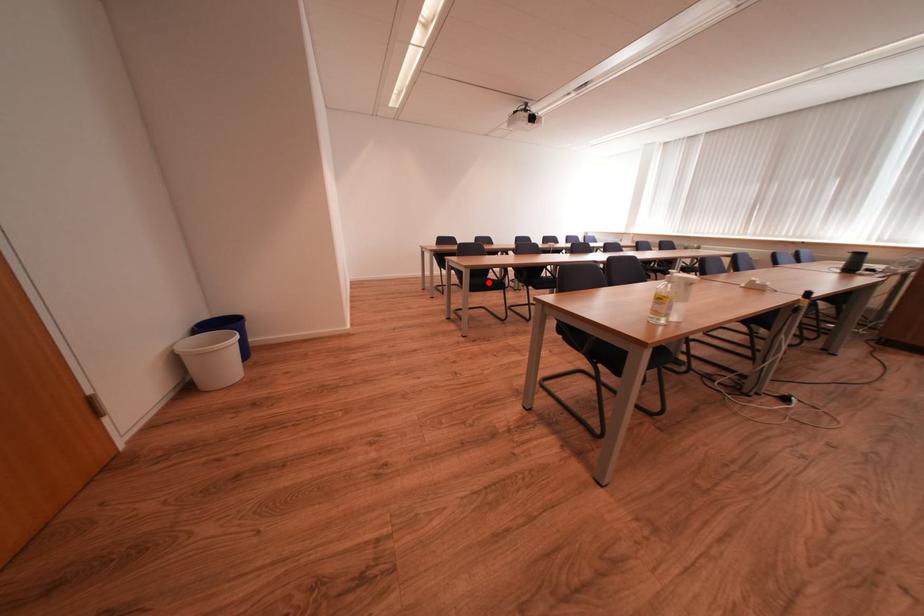
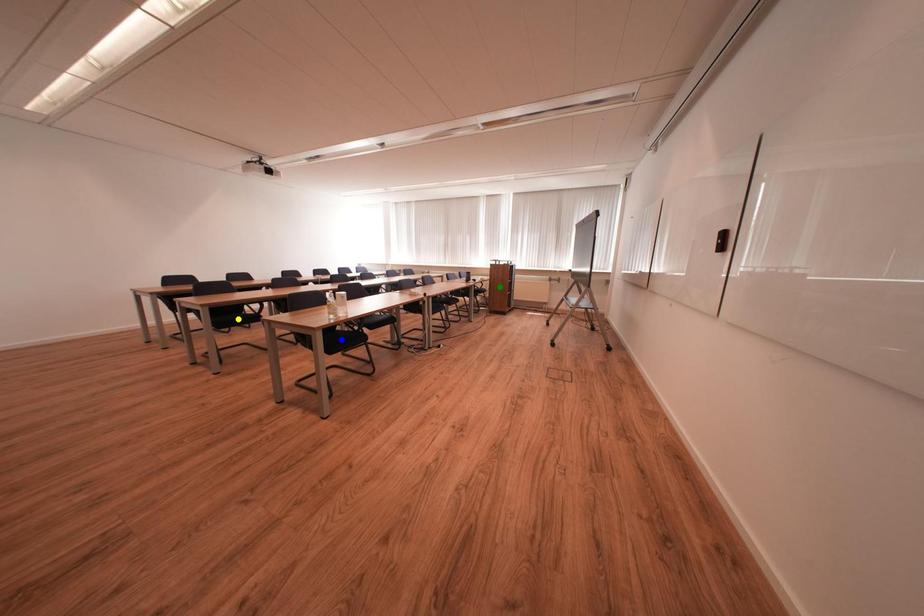
Question: I am providing you with two images of the same scene from different viewpoints. A red point is marked on the first image. You are given multiple points on the second image. Can you choose the point in image 2 that corresponds to the point in image 1?

Choices:
 (A) yellow point
 (B) green point
 (C) blue point

Answer: (A)